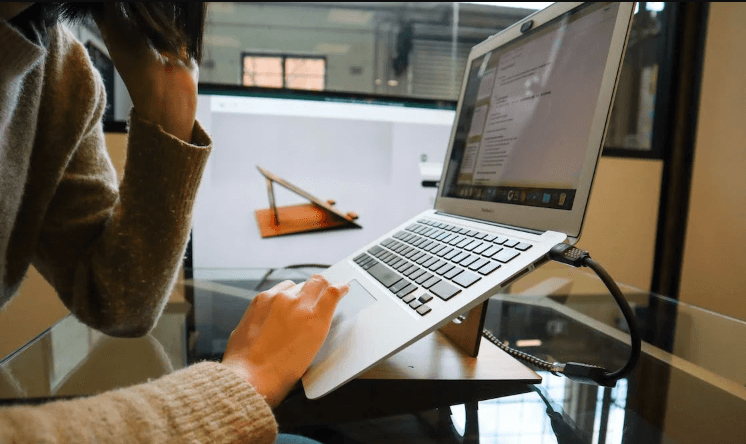
Locate an element on the screen. The image size is (746, 444). video stand is located at coordinates (315, 218).